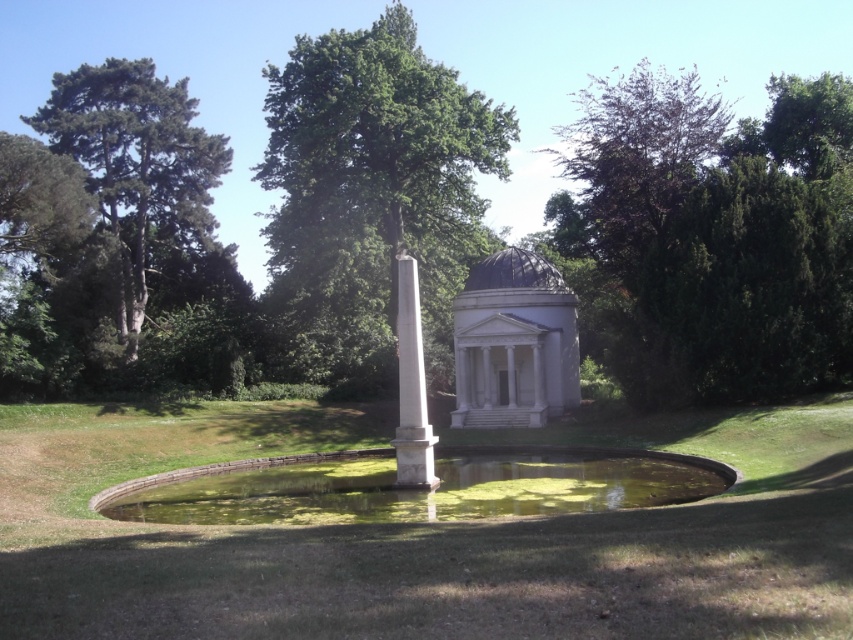
You are standing in the park and want to take a photo of the green grass at center and the green leafy tree at upper center. Which object should you focus on first if you want to capture both in a single frame without moving your camera? Explain your reasoning based on their positions.

You should focus on the green leafy tree at upper center first because the green grass at center is to the left of it, meaning the tree is positioned more towards the right. By centering the tree in your frame, the grass will naturally be included to its left, ensuring both are captured without needing to adjust the camera position.

You are planning to install a new lighting system in the park. The green leafy tree at left and the white marble gazebo at center are both candidates for the installation. Based on their heights, which object would require a taller lighting pole to properly illuminate?

The green leafy tree at left requires a taller lighting pole because it is much taller than the white marble gazebo at center.